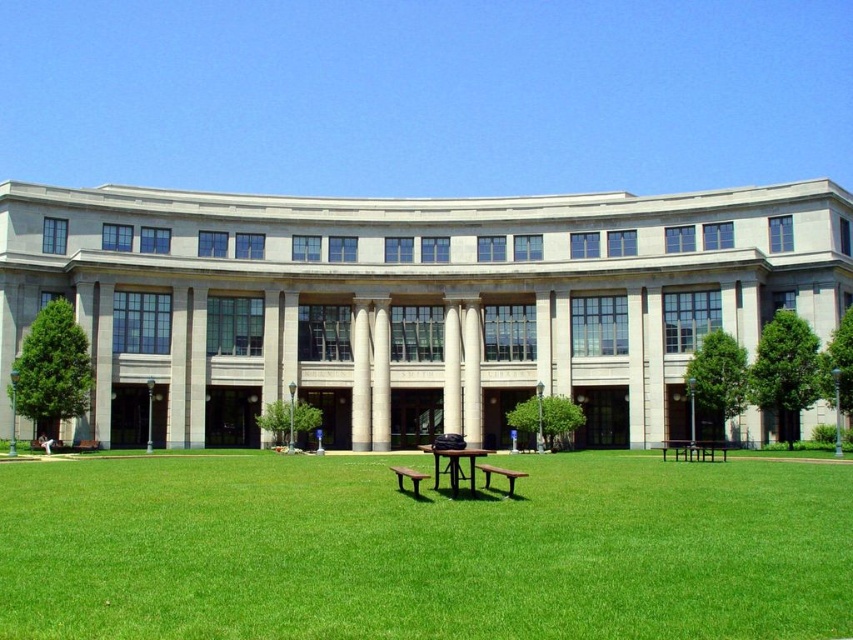
You are standing at the camera position and want to walk to the point marked at coordinates (x=482, y=449). How far will you have to walk to reach that point?

The point at coordinates (x=482, y=449) is 85.95 meters away from the camera, so you will have to walk 85.95 meters to reach it.

You are standing in front of the building and want to walk from point A to point B. Point A is located at coordinates point (x=677, y=444) and point B is at point (x=408, y=470). Which point is closer to you when you are facing the building?

Point (x=677, y=444) is closer to you because it is further to the viewer than point (x=408, y=470), meaning it is nearer in the foreground.

You are standing at the entrance of the classical building and want to find the brown wooden picnic table at center. Based on the coordinates provided, in which direction should you walk to reach it?

The brown wooden picnic table at center is located at coordinates point (456, 465). Since you are at the entrance of the classical building, which is likely at the front of the building facing the lawn, you should walk towards the center of the lawn to reach the picnic table.